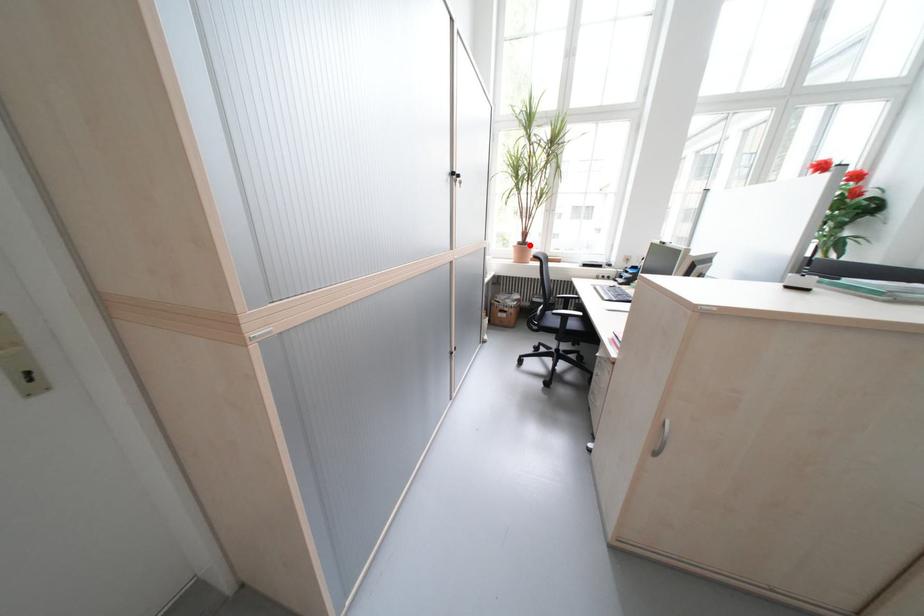
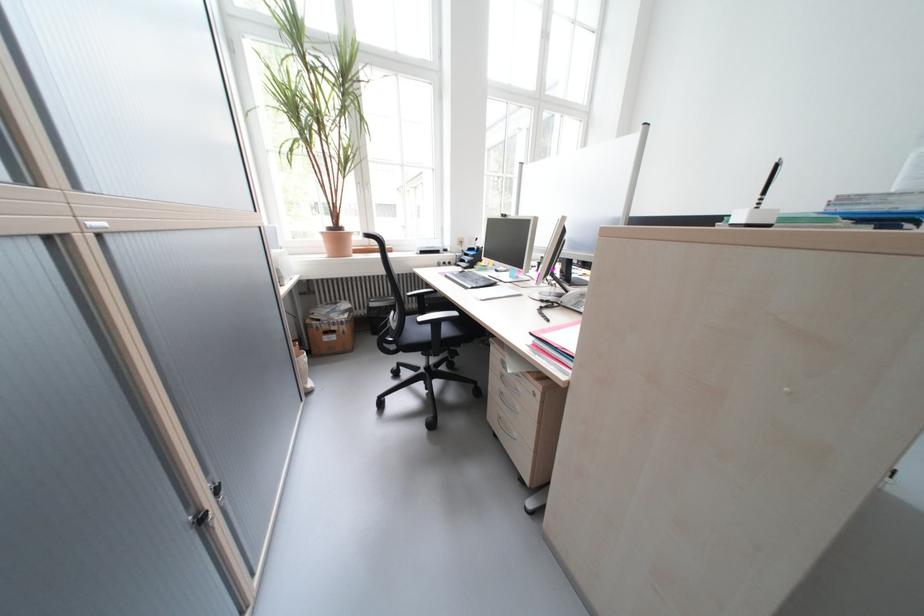
Question: A red point is marked in image1. In image2, is the corresponding 3D point closer to the camera or farther? Reply with the corresponding letter.

Choices:
 (A) The corresponding 3D point is closer.
 (B) The corresponding 3D point is farther.

Answer: (B)